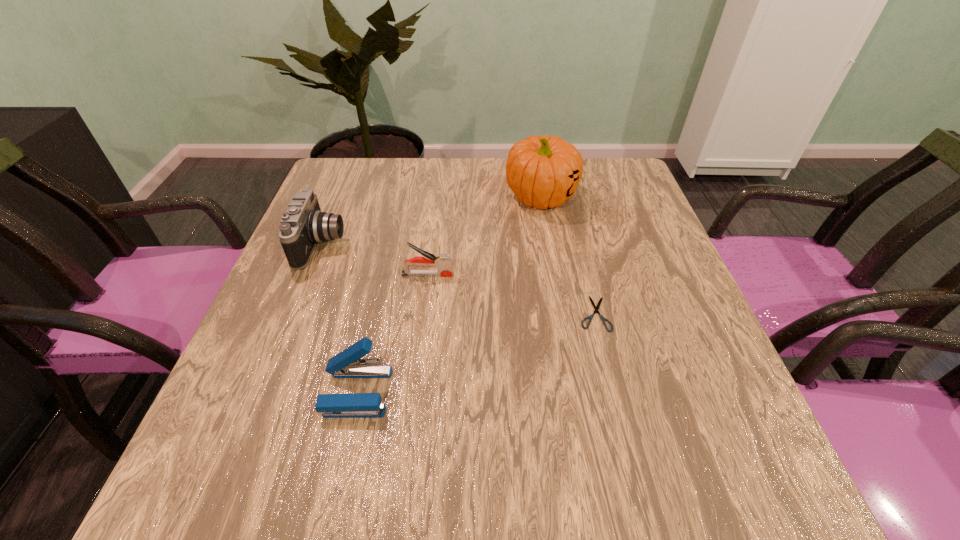
Find the location of `object that stands as the closest to the fourth shortest object`. object that stands as the closest to the fourth shortest object is located at coordinates (442, 262).

Point out which object is positioned as the third nearest to the nearest object. Please provide its 2D coordinates. Your answer should be formatted as a tuple, i.e. [(x, y)], where the tuple contains the x and y coordinates of a point satisfying the conditions above.

[(596, 308)]

Locate an element on the screen. This screenshot has width=960, height=540. free space that satisfies the following two spatial constraints: 1. on the front-facing side of the fourth shortest object; 2. on the back side of the nearest object is located at coordinates (263, 392).

You are a GUI agent. You are given a task and a screenshot of the screen. Output one action in this format:
    pyautogui.click(x=<x>, y=<y>)
    Task: Click on the free space in the image that satisfies the following two spatial constraints: 1. on the surface of the farthest object; 2. on the handle side of the farther stapler
    The height and width of the screenshot is (540, 960).
    Given the screenshot: What is the action you would take?
    pyautogui.click(x=555, y=274)

This screenshot has height=540, width=960. What are the coordinates of `free point that satisfies the following two spatial constraints: 1. on the back side of the second nearest object; 2. on the right side of the nearest object` in the screenshot? It's located at (374, 313).

I want to click on free space that satisfies the following two spatial constraints: 1. on the surface of the farthest object; 2. on the left side of the shortest object, so click(562, 313).

Where is `free space that satisfies the following two spatial constraints: 1. on the front-facing side of the nearer stapler; 2. on the right side of the second tallest object`? This screenshot has width=960, height=540. free space that satisfies the following two spatial constraints: 1. on the front-facing side of the nearer stapler; 2. on the right side of the second tallest object is located at coordinates (263, 392).

Where is `free space that satisfies the following two spatial constraints: 1. on the handle side of the farther stapler; 2. on the back side of the shears`? This screenshot has width=960, height=540. free space that satisfies the following two spatial constraints: 1. on the handle side of the farther stapler; 2. on the back side of the shears is located at coordinates (422, 313).

The image size is (960, 540). What are the coordinates of `free spot that satisfies the following two spatial constraints: 1. on the front-facing side of the shears; 2. on the left side of the leftmost object` in the screenshot? It's located at pos(294,313).

Locate an element on the screen. free location that satisfies the following two spatial constraints: 1. on the handle side of the second nearest object; 2. on the right side of the farther stapler is located at coordinates (422, 313).